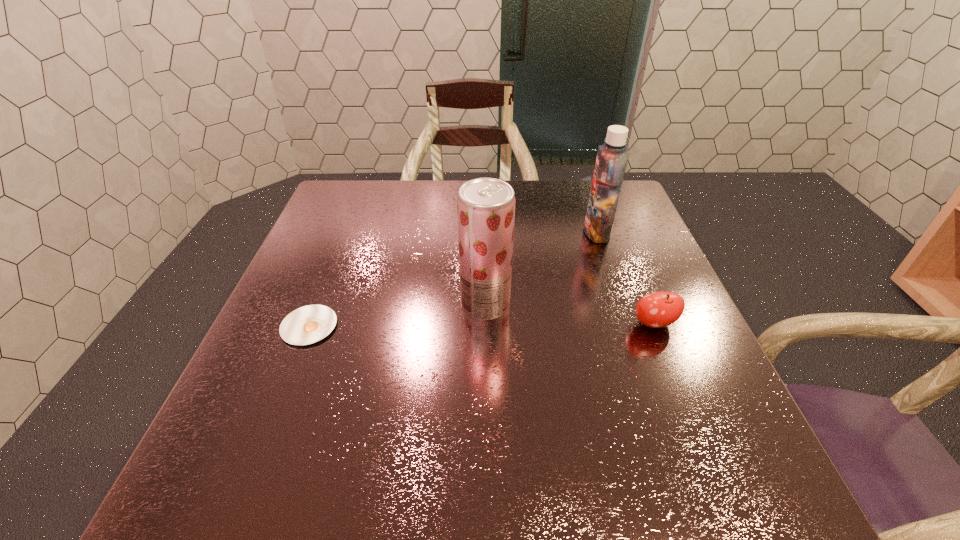
You are a GUI agent. You are given a task and a screenshot of the screen. Output one action in this format:
    pyautogui.click(x=<x>, y=<y>)
    Task: Click on the shampoo
    The image size is (960, 540).
    Given the screenshot: What is the action you would take?
    pyautogui.click(x=612, y=156)

Locate an element on the screen. This screenshot has height=540, width=960. the third object from right to left is located at coordinates (486, 206).

The image size is (960, 540). I want to click on apple, so click(x=658, y=309).

I want to click on the shortest object, so pos(309,324).

This screenshot has height=540, width=960. Find the location of `egg yolk`. egg yolk is located at coordinates (309, 324).

At what (x,y) coordinates should I click in order to perform the action: click on vacant area situated on the front label of the shampoo. Please return your answer as a coordinate pair (x, y). Image resolution: width=960 pixels, height=540 pixels. Looking at the image, I should click on (536, 232).

The height and width of the screenshot is (540, 960). Find the location of `vacant space situated on the front label of the shampoo`. vacant space situated on the front label of the shampoo is located at coordinates (495, 232).

Where is `vacant region located 0.260m on the front label of the shampoo`? This screenshot has height=540, width=960. vacant region located 0.260m on the front label of the shampoo is located at coordinates (488, 232).

Where is `vacant space located on the front of the fruit juice`? Image resolution: width=960 pixels, height=540 pixels. vacant space located on the front of the fruit juice is located at coordinates (486, 340).

Image resolution: width=960 pixels, height=540 pixels. Find the location of `free space located on the left of the third tallest object`. free space located on the left of the third tallest object is located at coordinates (603, 324).